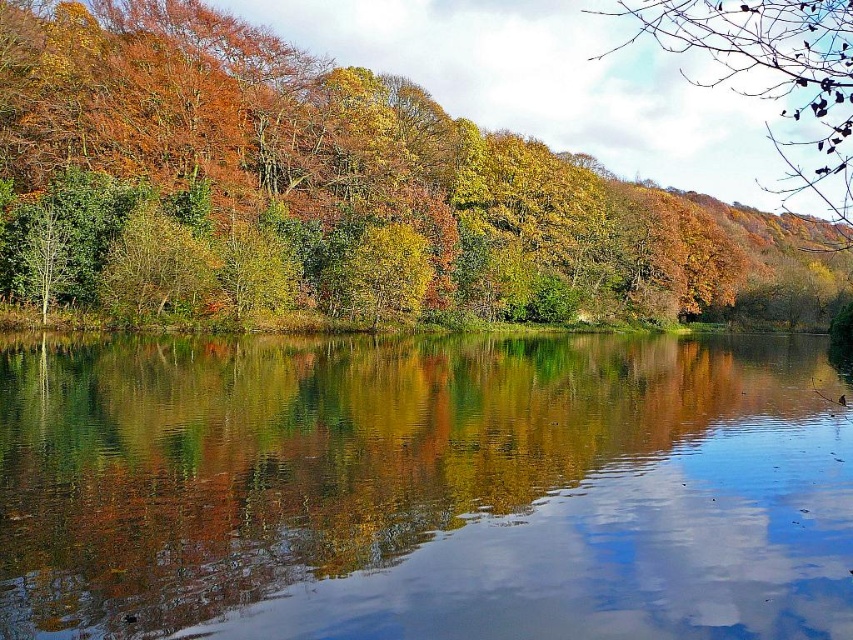
Question: Does transparent water at center have a larger size compared to autumn leaves at center?

Choices:
 (A) yes
 (B) no

Answer: (B)

Question: Which of the following is the farthest from the observer?

Choices:
 (A) (360, 260)
 (B) (151, 285)
 (C) (749, 29)

Answer: (C)

Question: Does autumn leaves at upper right appear over yellow-green leafy tree at center?

Choices:
 (A) yes
 (B) no

Answer: (A)

Question: Which object is positioned closest to the autumn leaves at upper right?

Choices:
 (A) autumn leaves at center
 (B) transparent water at center
 (C) green matte tree at center
 (D) yellow-green leafy tree at center

Answer: (A)

Question: Considering the real-world distances, which object is farthest from the autumn leaves at upper right?

Choices:
 (A) green matte tree at center
 (B) yellow-green leafy tree at center
 (C) transparent water at center
 (D) autumn leaves at center

Answer: (C)

Question: Does autumn leaves at upper right lie in front of yellow-green leafy tree at center?

Choices:
 (A) no
 (B) yes

Answer: (B)